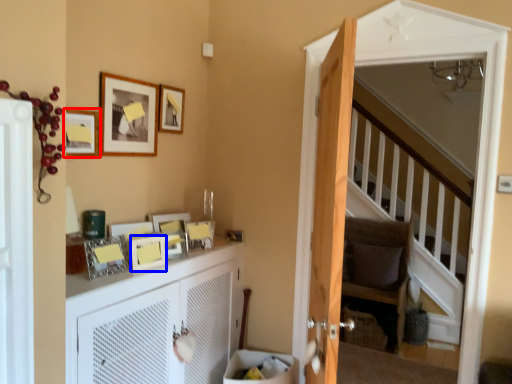
Question: Which of the following is the farthest to the observer, picture frame (highlighted by a red box) or picture frame (highlighted by a blue box)?

Choices:
 (A) picture frame
 (B) picture frame

Answer: (B)